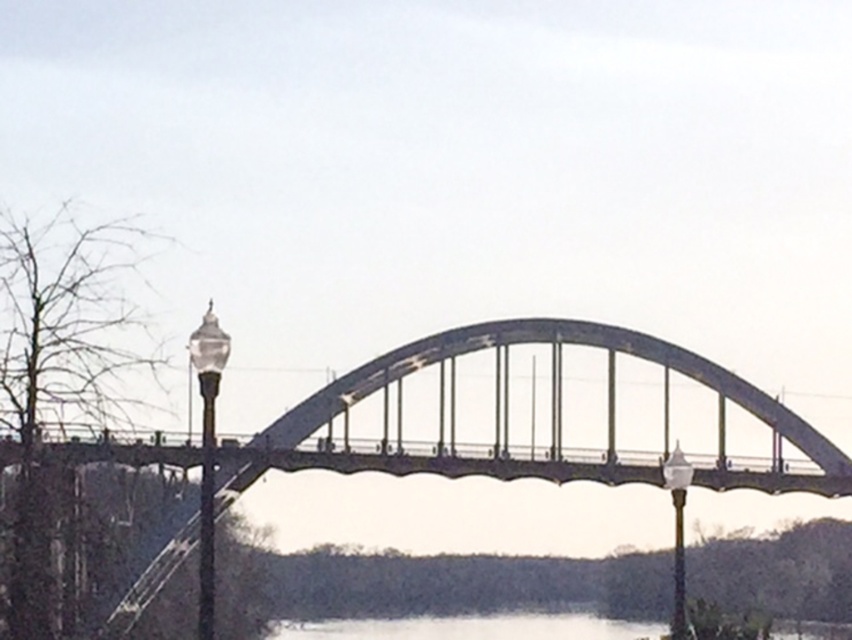
You are standing at the center of the arched bridge and want to locate the clear glass lamp post at left. In which direction should you look to see it?

You should look to your left to see the clear glass lamp post at left, as it is positioned at point (x=206, y=452), which is to the left side of the bridge.

You are a city planner reviewing the bridge design. You notice the clear glass lamp post at left and the white glass lamp post at center. Which lamp post is taller?

The clear glass lamp post at left is taller than the white glass lamp post at center.

You are standing on the bridge and want to take a photo of the clear glass lamp post at left and the white glass lamp post at center. Which lamp post will appear larger in your photo?

The clear glass lamp post at left will appear larger in the photo because it is closer to the viewer than the white glass lamp post at center.